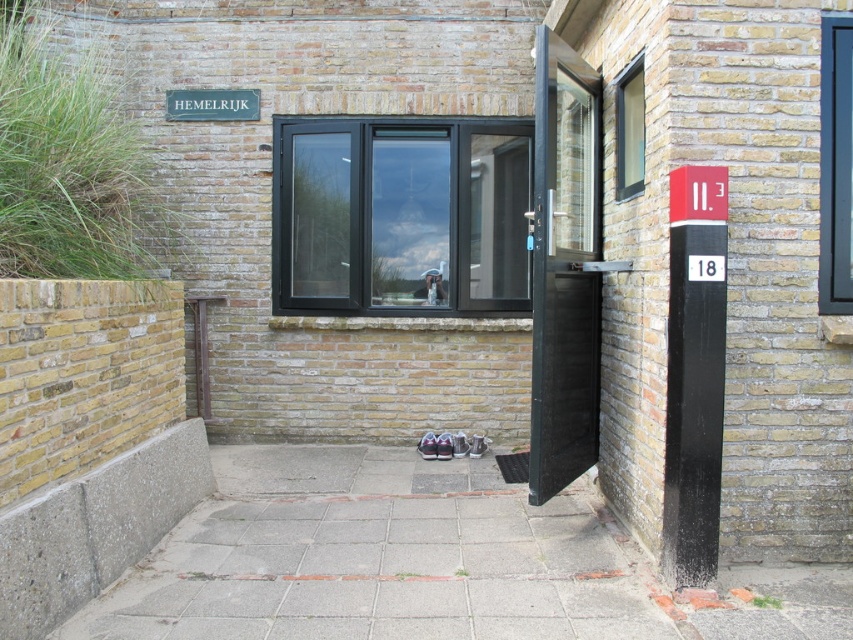
You are a delivery person with a 7.5 foot long ladder that needs to be placed between the gray concrete pavement at lower center and the transparent glass window at upper right. Can the ladder fit horizontally between them?

The distance between the gray concrete pavement at lower center and the transparent glass window at upper right is 8.34 feet, which is longer than the ladder length of 7.5 feet. Therefore, the ladder can fit horizontally between them.

You are standing in front of the brick building and notice two points marked on the ground. The first point is at coordinate point (635, 156) and the second is at point (190, 100). If you want to move from the entrance towards the second point, which direction should you walk relative to the first point?

To move from the entrance towards the second point at point (190, 100), you should walk away from the first point at point (635, 156) since it is closer to you than the second point.